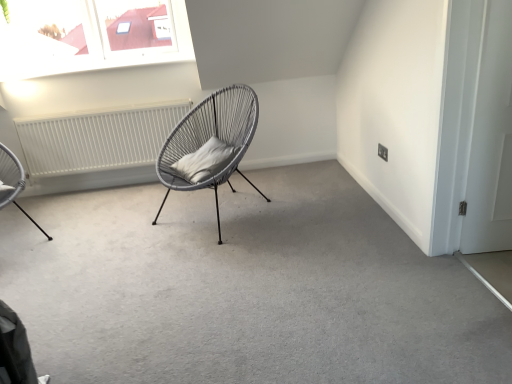
Identify the location of unoccupied area in front of white matte door at right. (497, 251).